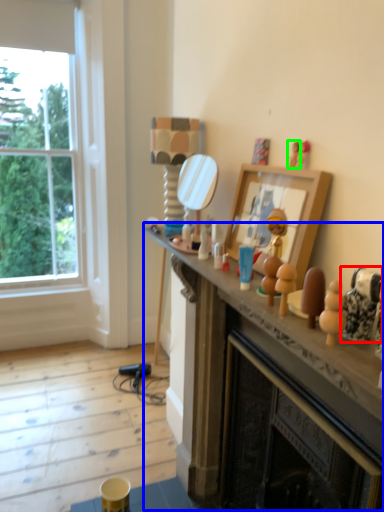
Question: Which object is the farthest from toy (highlighted by a red box)? Choose among these: mantle (highlighted by a blue box) or toy (highlighted by a green box).

Choices:
 (A) mantle
 (B) toy

Answer: (A)